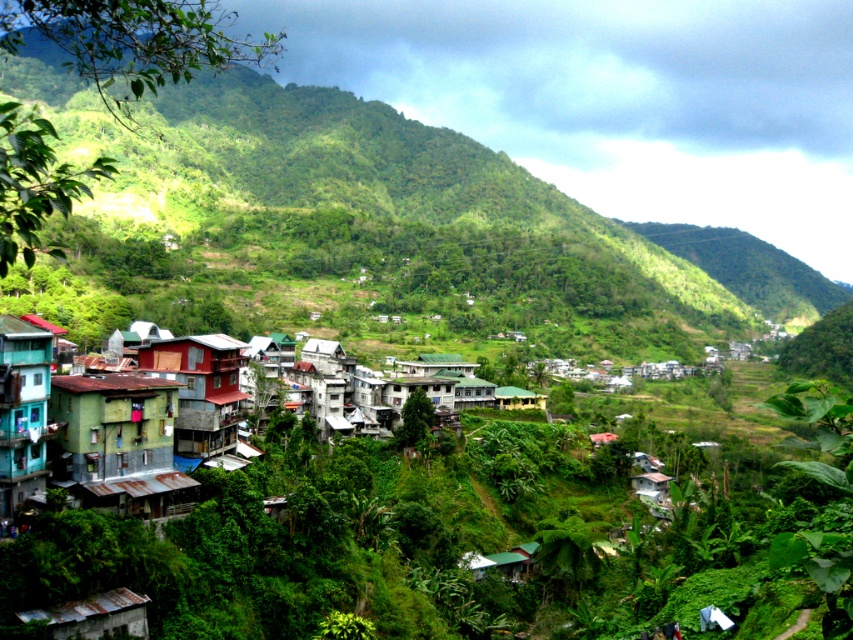
Question: Can you confirm if green matte building at lower left is smaller than rustic wood hut at center-left?

Choices:
 (A) yes
 (B) no

Answer: (A)

Question: Which point is closer to the camera?

Choices:
 (A) (132, 468)
 (B) (544, 204)
 (C) (200, 362)

Answer: (A)

Question: Considering the relative positions of rustic wood hut at center-left and teal painted wooden house at lower left in the image provided, where is rustic wood hut at center-left located with respect to teal painted wooden house at lower left?

Choices:
 (A) below
 (B) above

Answer: (B)

Question: Can you confirm if rusty metal shacks at lower left is smaller than green corrugated metal hut at lower center?

Choices:
 (A) yes
 (B) no

Answer: (B)

Question: Estimate the real-world distances between objects in this image. Which object is farther from the rustic wood hut at center-left?

Choices:
 (A) green matte building at lower left
 (B) green corrugated metal hut at lower center
 (C) green leafy hillside at center

Answer: (C)

Question: Among these points, which one is nearest to the camera?

Choices:
 (A) (126, 456)
 (B) (9, 326)
 (C) (138, 620)

Answer: (C)